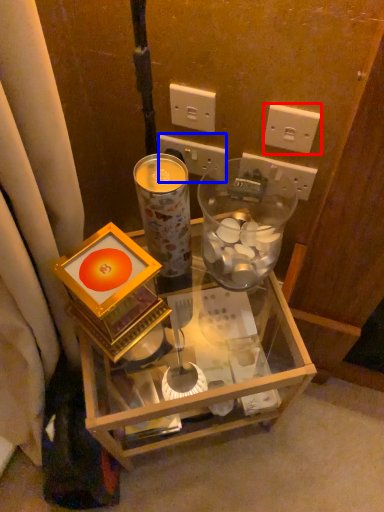
Question: Which point is closer to the camera, power outlet (highlighted by a red box) or power outlet (highlighted by a blue box)?

Choices:
 (A) power outlet
 (B) power outlet

Answer: (A)